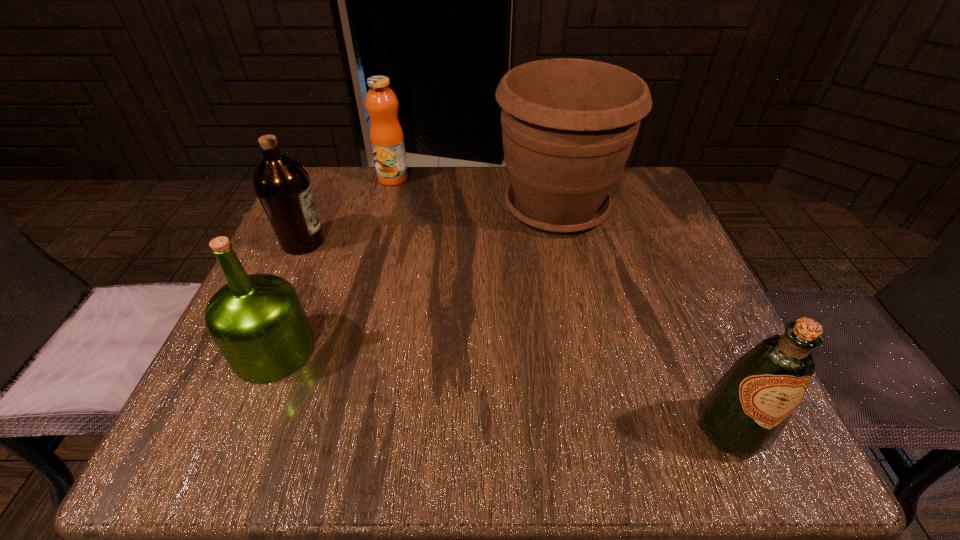
The height and width of the screenshot is (540, 960). I want to click on flowerpot that is at the far edge, so click(x=568, y=125).

Identify the location of fruit juice at the far edge. This screenshot has height=540, width=960. (386, 135).

Locate an element on the screen. The width and height of the screenshot is (960, 540). object located at the near edge is located at coordinates (744, 413).

Identify the location of flowerpot that is positioned at the right edge. This screenshot has height=540, width=960. (568, 125).

Find the location of a particular element. This screenshot has height=540, width=960. olive oil that is at the right edge is located at coordinates (744, 413).

Locate an element on the screen. The width and height of the screenshot is (960, 540). object positioned at the far right corner is located at coordinates (568, 125).

You are a GUI agent. You are given a task and a screenshot of the screen. Output one action in this format:
    pyautogui.click(x=<x>, y=<y>)
    Task: Click on the object at the near right corner
    
    Given the screenshot: What is the action you would take?
    pyautogui.click(x=744, y=413)

Where is `free point at the far edge`? free point at the far edge is located at coordinates (417, 175).

I want to click on vacant space at the near edge of the desktop, so tap(367, 444).

Find the location of a particular element. This screenshot has width=960, height=540. vacant space at the left edge of the desktop is located at coordinates click(x=352, y=228).